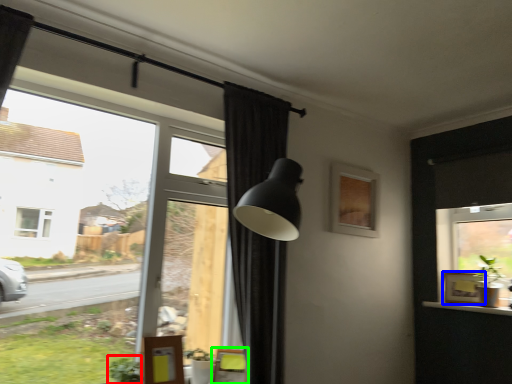
Question: Estimate the real-world distances between objects in this image. Which object is closer to plant (highlighted by a red box), picture frame (highlighted by a blue box) or swivel chair (highlighted by a green box)?

Choices:
 (A) picture frame
 (B) swivel chair

Answer: (B)